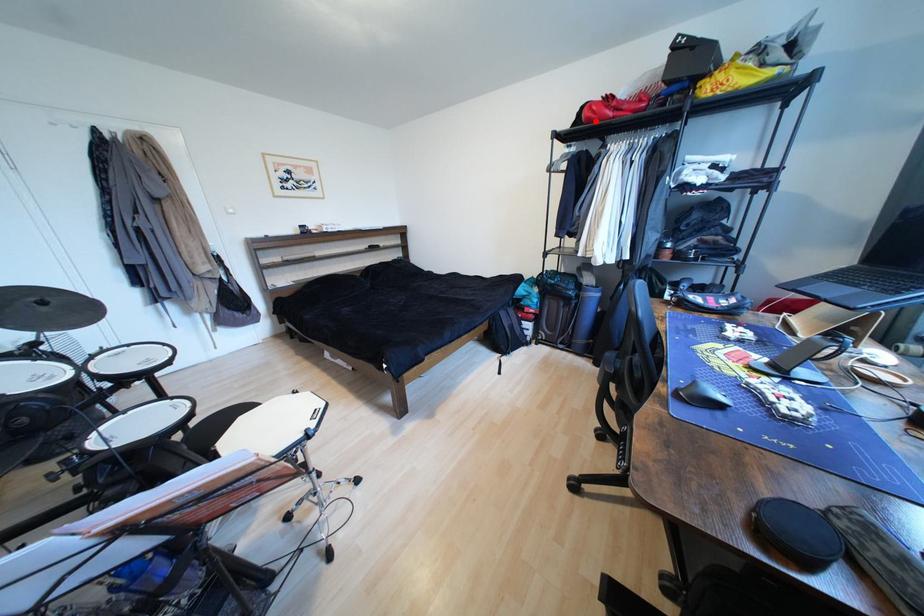
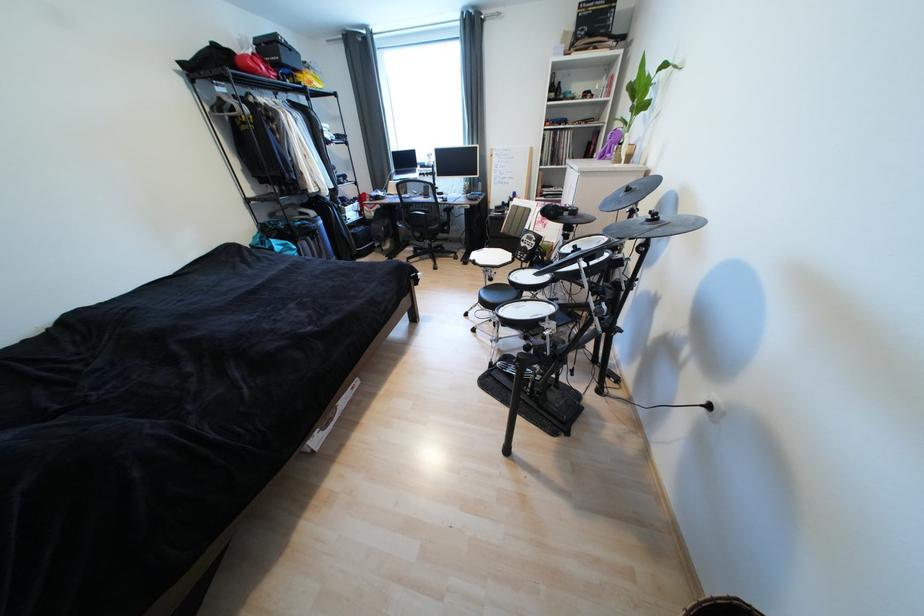
Find the pixel in the second image that matches the highlighted location in the first image.

(261, 73)